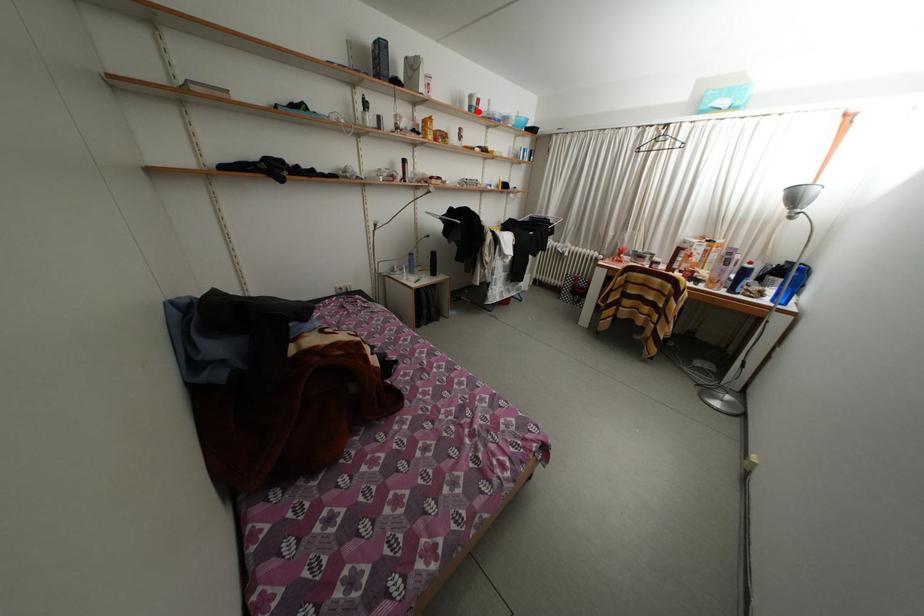
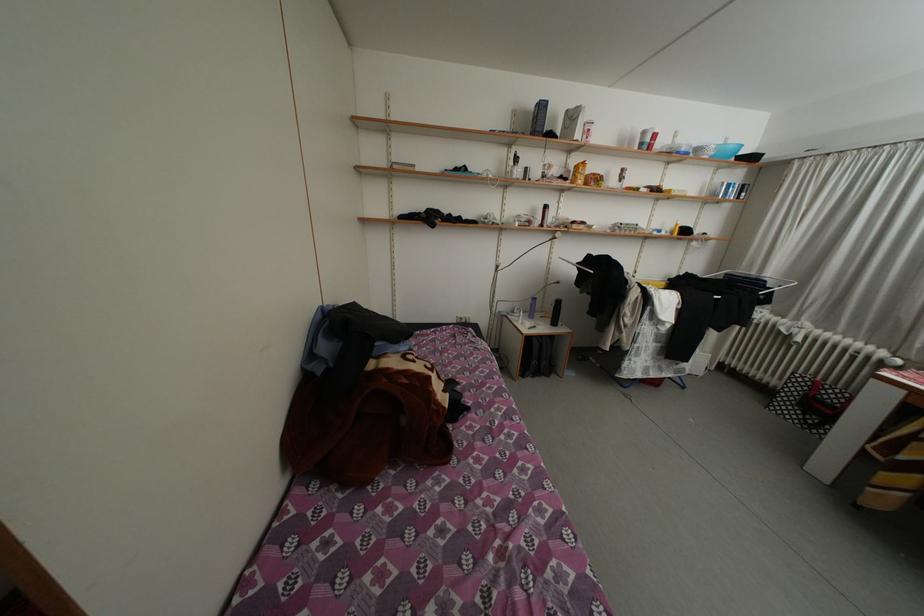
Locate, in the second image, the point that corresponds to the highlighted location in the first image.

(650, 148)